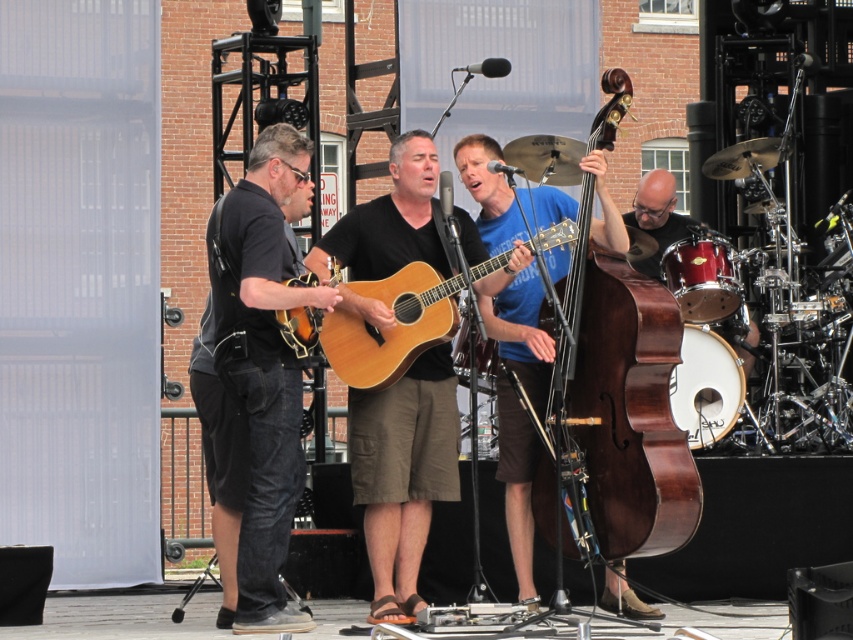
Question: Which of these objects is positioned farthest from the natural wood acoustic guitar at center?

Choices:
 (A) brown polished wood cello at right
 (B) matte wood guitar at center
 (C) shiny black drum at right
 (D) denim jeans at left

Answer: (C)

Question: Can you confirm if denim jeans at left is positioned to the left of natural wood acoustic guitar at center?

Choices:
 (A) yes
 (B) no

Answer: (A)

Question: Is brown polished wood cello at right smaller than natural wood acoustic guitar at center?

Choices:
 (A) no
 (B) yes

Answer: (A)

Question: Which point is closer to the camera?

Choices:
 (A) brown polished wood cello at right
 (B) shiny black drum at right
 (C) natural wood acoustic guitar at center

Answer: (A)

Question: From the image, what is the correct spatial relationship of matte wood guitar at center in relation to natural wood acoustic guitar at center?

Choices:
 (A) right
 (B) left

Answer: (A)

Question: Which point appears closest to the camera in this image?

Choices:
 (A) (563, 496)
 (B) (410, 337)
 (C) (257, 529)

Answer: (C)